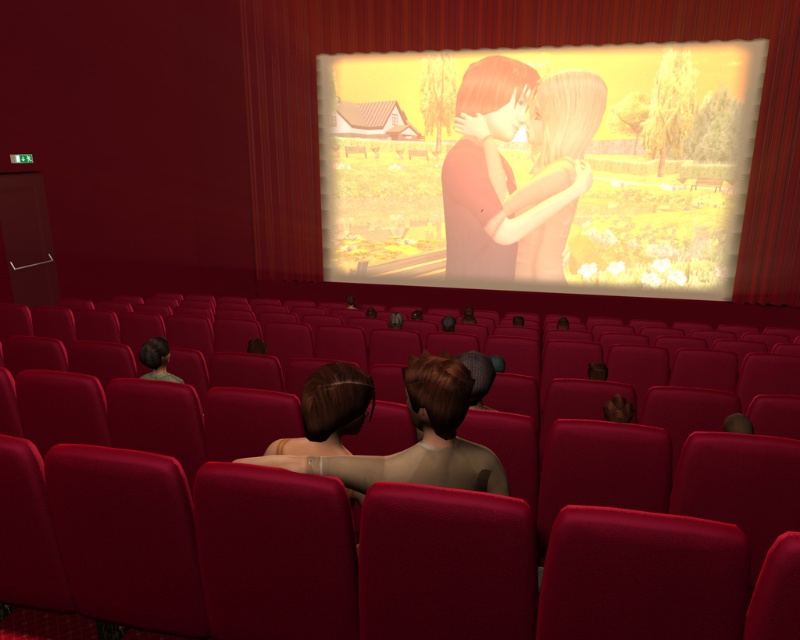
Question: Can you confirm if smooth skin couple at center is positioned below brown matte hair at center?

Choices:
 (A) no
 (B) yes

Answer: (A)

Question: Does smooth skin couple at center appear on the right side of brown matte hair at center?

Choices:
 (A) no
 (B) yes

Answer: (B)

Question: Does smooth skin couple at center appear under brown matte hair at center?

Choices:
 (A) no
 (B) yes

Answer: (A)